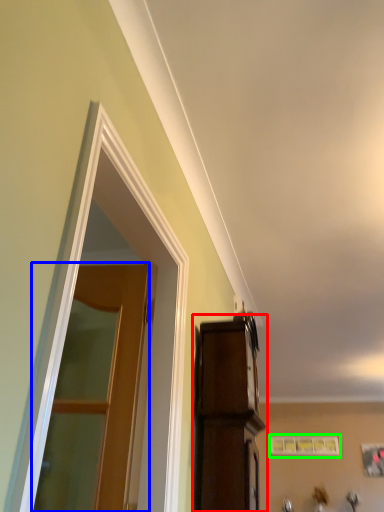
Question: Which object is the farthest from cabinetry (highlighted by a red box)? Choose among these: door (highlighted by a blue box) or picture frame (highlighted by a green box).

Choices:
 (A) door
 (B) picture frame

Answer: (B)